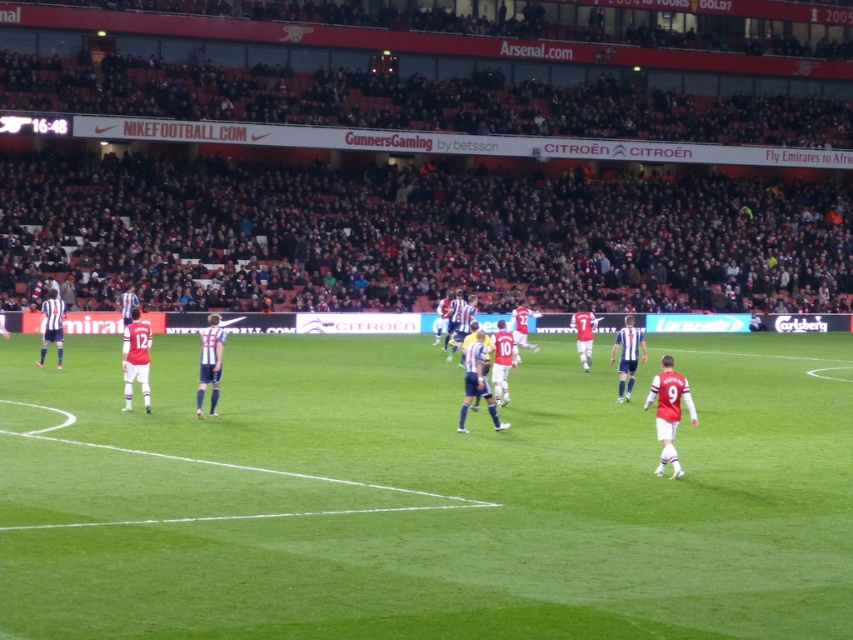
Can you confirm if dark gray crowd at upper center is taller than white jersey at center?

Correct, dark gray crowd at upper center is much taller as white jersey at center.

Is point (741, 250) positioned before point (469, 397)?

No, it is behind (469, 397).

Where is `dark gray crowd at upper center`? This screenshot has height=640, width=853. dark gray crowd at upper center is located at coordinates (453, 234).

Who is higher up, white jersey at center or striped jersey at left?

striped jersey at left is above.

Who is more distant from viewer, [480,337] or [45,337]?

Point [45,337]

Between point (469, 348) and point (45, 324), which one is positioned in front?

Point (469, 348) is in front.

Where is `white jersey at center`? The width and height of the screenshot is (853, 640). white jersey at center is located at coordinates (477, 380).

Which is behind, point (122, 529) or point (51, 340)?

Positioned behind is point (51, 340).

Is the position of green grass football field at center less distant than that of striped jersey at left?

Yes, it is.

Locate an element on the screen. green grass football field at center is located at coordinates (425, 493).

Locate an element on the screen. green grass football field at center is located at coordinates (425, 493).